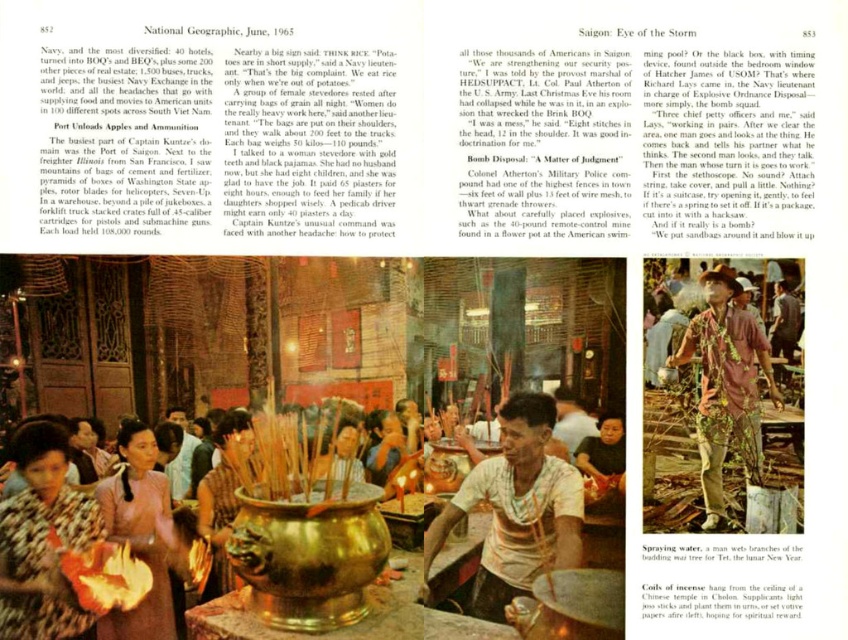
Question: In this image, where is white cotton shirt at center located relative to smooth brown incense sticks at center?

Choices:
 (A) right
 (B) left

Answer: (B)

Question: Is white cotton shirt at center smaller than smooth brown incense sticks at center?

Choices:
 (A) yes
 (B) no

Answer: (B)

Question: Is the position of matte gold statue at center more distant than that of green leafy garland at center?

Choices:
 (A) yes
 (B) no

Answer: (A)

Question: Which of the following is the closest to the observer?

Choices:
 (A) smooth brown incense sticks at center
 (B) green leafy garland at center
 (C) white cotton shirt at center

Answer: (A)

Question: Which object appears closest to the camera in this image?

Choices:
 (A) fluffy leopard print dress at center
 (B) smooth brown incense sticks at center

Answer: (A)

Question: Which of the following is the farthest from the observer?

Choices:
 (A) matte gold statue at center
 (B) green leafy garland at center
 (C) fluffy leopard print dress at center

Answer: (A)